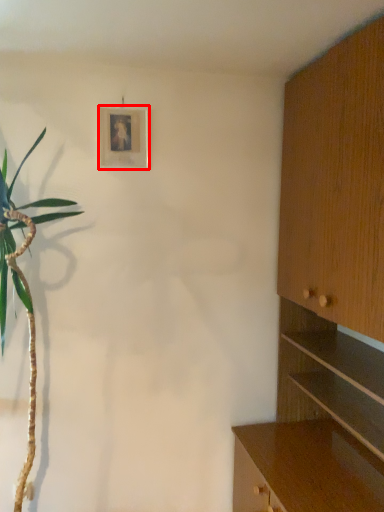
Question: Observing the image, what is the correct spatial positioning of picture frame (annotated by the red box) in reference to cabinetry?

Choices:
 (A) right
 (B) left

Answer: (B)